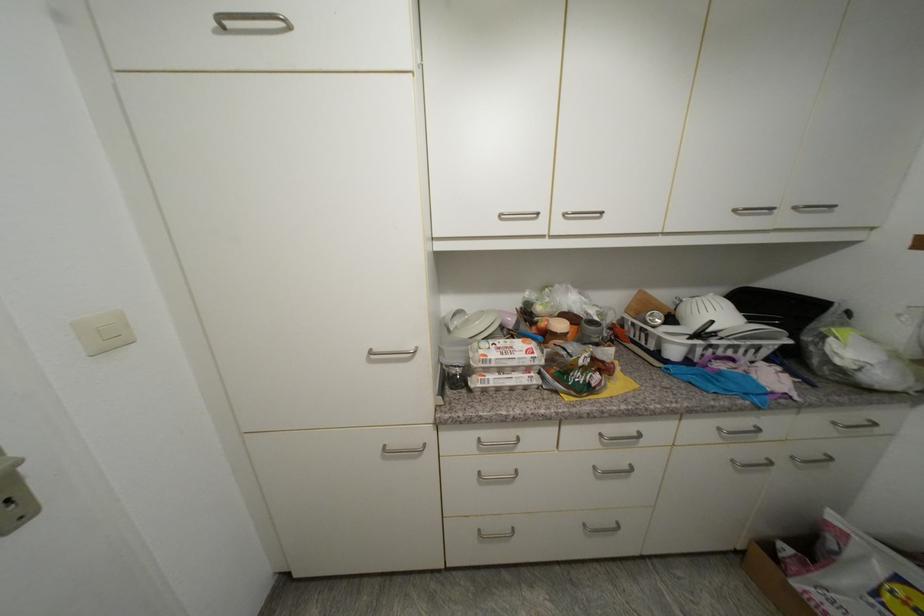
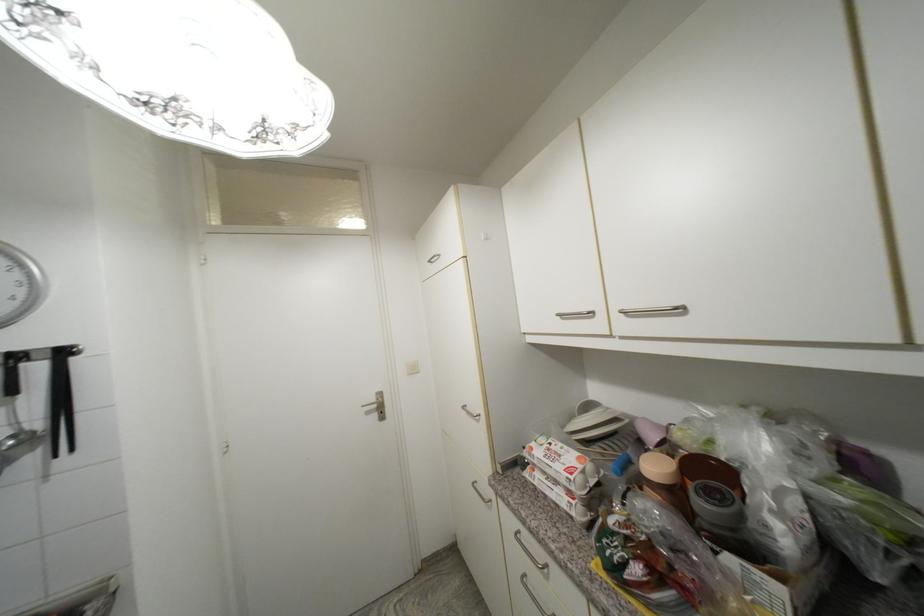
Question: How did the camera likely rotate?

Choices:
 (A) Left
 (B) Right
 (C) Up
 (D) Down

Answer: (A)